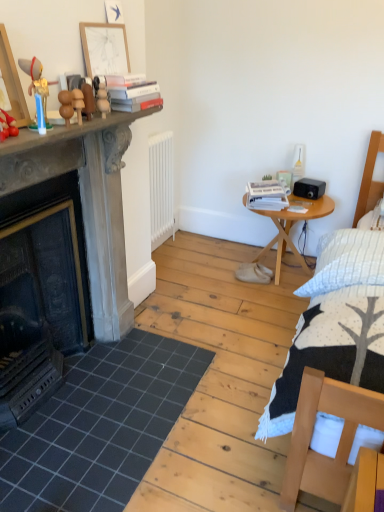
Question: Is smooth stone fireplace at left to the left of white matte radiator at center from the viewer's perspective?

Choices:
 (A) no
 (B) yes

Answer: (B)

Question: Is white matte radiator at center inside smooth stone fireplace at left?

Choices:
 (A) no
 (B) yes

Answer: (A)

Question: Are smooth stone fireplace at left and white matte radiator at center far apart?

Choices:
 (A) no
 (B) yes

Answer: (A)

Question: Would you say smooth stone fireplace at left is outside white matte radiator at center?

Choices:
 (A) yes
 (B) no

Answer: (A)

Question: From a real-world perspective, is smooth stone fireplace at left below white matte radiator at center?

Choices:
 (A) yes
 (B) no

Answer: (B)

Question: Is smooth stone fireplace at left wider than white matte radiator at center?

Choices:
 (A) yes
 (B) no

Answer: (A)

Question: Does wooden figurine at left, the 3th toy positioned from the back, have a lesser height compared to wooden round table at right?

Choices:
 (A) no
 (B) yes

Answer: (B)

Question: Considering the relative positions of wooden figurine at left, the first toy positioned from the front, and wooden round table at right in the image provided, is wooden figurine at left, the first toy positioned from the front, to the left of wooden round table at right from the viewer's perspective?

Choices:
 (A) no
 (B) yes

Answer: (B)

Question: From a real-world perspective, is wooden figurine at left, the first toy positioned from the front, located higher than wooden round table at right?

Choices:
 (A) no
 (B) yes

Answer: (B)

Question: Does wooden figurine at left, which is counted as the 1th toy, starting from the left, appear on the right side of wooden round table at right?

Choices:
 (A) yes
 (B) no

Answer: (B)

Question: Does wooden figurine at left, the first toy positioned from the front, have a greater height compared to wooden round table at right?

Choices:
 (A) no
 (B) yes

Answer: (A)

Question: Is wooden figurine at left, the 3th toy positioned from the back, bigger than wooden round table at right?

Choices:
 (A) no
 (B) yes

Answer: (A)

Question: Considering the relative sizes of hardcover books at upper center, arranged as the first book when viewed from the front, and white matte radiator at center in the image provided, is hardcover books at upper center, arranged as the first book when viewed from the front, wider than white matte radiator at center?

Choices:
 (A) yes
 (B) no

Answer: (A)